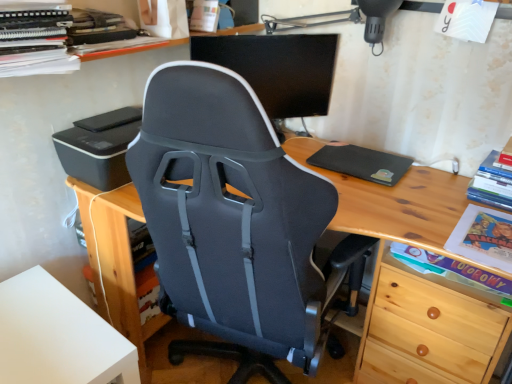
Describe the element at coordinates (492, 184) in the screenshot. I see `hardcover book at right, marked as the first book in a right-to-left arrangement` at that location.

What do you see at coordinates (403, 214) in the screenshot? The image size is (512, 384). I see `wooden desk at center` at bounding box center [403, 214].

Describe the element at coordinates (99, 147) in the screenshot. I see `black plastic printer at left` at that location.

The image size is (512, 384). What do you see at coordinates (35, 38) in the screenshot? I see `orange spiral-bound book at upper left, positioned as the 3th book in right-to-left order` at bounding box center [35, 38].

Locate an element on the screen. hardcover book at right, which appears as the third book when viewed from the left is located at coordinates (492, 184).

Is black matte/black rubberized mousepad at right far from black plastic printer at left?

No, black matte/black rubberized mousepad at right is not far from black plastic printer at left.

Does black matte/black rubberized mousepad at right appear on the left side of black plastic printer at left?

In fact, black matte/black rubberized mousepad at right is to the right of black plastic printer at left.

Does black matte/black rubberized mousepad at right lie in front of black plastic printer at left?

No, the depth of black matte/black rubberized mousepad at right is greater than that of black plastic printer at left.

Between black matte/black rubberized mousepad at right and black plastic printer at left, which one has larger width?

black plastic printer at left.

Locate an element on the screen. printer behind the hardcover book at right, the second book from the bottom is located at coordinates (99, 147).

Is black plastic printer at left wider or thinner than hardcover book at right, which appears as the third book when viewed from the left?

black plastic printer at left is wider than hardcover book at right, which appears as the third book when viewed from the left.

From the picture: Is black plastic printer at left further to camera compared to hardcover book at right, which appears as the third book when viewed from the left?

That is True.

Based on the photo, considering the sizes of objects matte cardboard book at lower right, placed as the 1th book when sorted from bottom to top, and wooden desk at center in the image provided, who is taller, matte cardboard book at lower right, placed as the 1th book when sorted from bottom to top, or wooden desk at center?

With more height is wooden desk at center.

Does matte cardboard book at lower right, the second book in the right-to-left sequence, turn towards wooden desk at center?

Yes, matte cardboard book at lower right, the second book in the right-to-left sequence, is oriented towards wooden desk at center.

Consider the image. Which object is closer to the camera taking this photo, matte cardboard book at lower right, placed as the 1th book when sorted from bottom to top, or wooden desk at center?

wooden desk at center.

Which of these two, matte cardboard book at lower right, which ranks as the 2th book in left-to-right order, or wooden desk at center, is bigger?

wooden desk at center is bigger.

From the image's perspective, which is above, black plastic printer at left or orange spiral-bound book at upper left, which is the 1th book from left to right?

orange spiral-bound book at upper left, which is the 1th book from left to right, appears higher in the image.

Considering the relative sizes of black plastic printer at left and orange spiral-bound book at upper left, the third book when ordered from bottom to top, in the image provided, is black plastic printer at left shorter than orange spiral-bound book at upper left, the third book when ordered from bottom to top,?

Yes.

Find the location of a particular element. Image resolution: width=512 pixels, height=384 pixels. book that is the 3rd one when counting forward from the black plastic printer at left is located at coordinates (35, 38).

Is black plastic printer at left inside or outside of orange spiral-bound book at upper left, which is the 1th book from left to right?

black plastic printer at left is not enclosed by orange spiral-bound book at upper left, which is the 1th book from left to right.

Between point (4, 15) and point (155, 190), which one is positioned behind?

The point (4, 15) is farther from the camera.

Which object is wider, orange spiral-bound book at upper left, positioned as the 3th book in right-to-left order, or matte black chair at center?

matte black chair at center is wider.

Based on the photo, from the image's perspective, is orange spiral-bound book at upper left, positioned as the 3th book in right-to-left order, above matte black chair at center?

Yes.

Considering the relative sizes of orange spiral-bound book at upper left, positioned as the 3th book in right-to-left order, and wooden desk at center in the image provided, is orange spiral-bound book at upper left, positioned as the 3th book in right-to-left order, taller than wooden desk at center?

No.

Between orange spiral-bound book at upper left, which is the 1th book from left to right, and wooden desk at center, which one has smaller size?

orange spiral-bound book at upper left, which is the 1th book from left to right, is smaller.

Is orange spiral-bound book at upper left, the first book from the top, in front of wooden desk at center?

No, the depth of orange spiral-bound book at upper left, the first book from the top, is greater than that of wooden desk at center.

Is orange spiral-bound book at upper left, positioned as the 3th book in right-to-left order, situated inside wooden desk at center or outside?

orange spiral-bound book at upper left, positioned as the 3th book in right-to-left order, cannot be found inside wooden desk at center.

From their relative heights in the image, would you say black matte/black rubberized mousepad at right is taller or shorter than orange spiral-bound book at upper left, the first book from the top?

Clearly, black matte/black rubberized mousepad at right is shorter compared to orange spiral-bound book at upper left, the first book from the top.

Is black matte/black rubberized mousepad at right in front of or behind orange spiral-bound book at upper left, the first book from the top, in the image?

Clearly, black matte/black rubberized mousepad at right is behind orange spiral-bound book at upper left, the first book from the top.

Looking at their sizes, would you say black matte/black rubberized mousepad at right is wider or thinner than orange spiral-bound book at upper left, which is the 1th book from left to right?

black matte/black rubberized mousepad at right is wider than orange spiral-bound book at upper left, which is the 1th book from left to right.

From the image's perspective, who appears lower, black matte/black rubberized mousepad at right or orange spiral-bound book at upper left, positioned as the 3th book in right-to-left order?

black matte/black rubberized mousepad at right.

Find the location of a particular element. This screenshot has width=512, height=384. printer located on the left of black matte/black rubberized mousepad at right is located at coordinates (99, 147).

At what (x,y) coordinates should I click in order to perform the action: click on printer behind the hardcover book at right, the second book from the bottom. Please return your answer as a coordinate pair (x, y). Image resolution: width=512 pixels, height=384 pixels. Looking at the image, I should click on (99, 147).

Estimate the real-world distances between objects in this image. Which object is further from black matte monitor at center, matte cardboard book at lower right, which is the 3th book from top to bottom, or matte black chair at center?

matte cardboard book at lower right, which is the 3th book from top to bottom.

Which object lies nearer to the anchor point hardcover book at right, which appears as the third book when viewed from the left, wooden desk at center or matte black chair at center?

wooden desk at center lies closer to hardcover book at right, which appears as the third book when viewed from the left, than the other object.

Looking at the image, which one is located closer to hardcover book at right, which appears as the third book when viewed from the left, black matte/black rubberized mousepad at right or white matte table at lower left?

Based on the image, black matte/black rubberized mousepad at right appears to be nearer to hardcover book at right, which appears as the third book when viewed from the left.

From the picture: From the image, which object appears to be farther from white matte table at lower left, matte black chair at center or orange spiral-bound book at upper left, which is the 1th book from left to right?

The object further to white matte table at lower left is orange spiral-bound book at upper left, which is the 1th book from left to right.

Which object lies nearer to the anchor point matte cardboard book at lower right, which is the 3th book from top to bottom, white matte table at lower left or black matte monitor at center?

black matte monitor at center is closer to matte cardboard book at lower right, which is the 3th book from top to bottom.

Estimate the real-world distances between objects in this image. Which object is further from wooden desk at center, orange spiral-bound book at upper left, positioned as the 3th book in right-to-left order, or matte cardboard book at lower right, which ranks as the 2th book in left-to-right order?

orange spiral-bound book at upper left, positioned as the 3th book in right-to-left order.

In the scene shown: Estimate the real-world distances between objects in this image. Which object is further from white matte table at lower left, hardcover book at right, positioned as the second book in top-to-bottom order, or black matte/black rubberized mousepad at right?

The object further to white matte table at lower left is hardcover book at right, positioned as the second book in top-to-bottom order.

Which object lies nearer to the anchor point matte cardboard book at lower right, placed as the 1th book when sorted from bottom to top, matte black chair at center or black matte/black rubberized mousepad at right?

black matte/black rubberized mousepad at right is positioned closer to the anchor matte cardboard book at lower right, placed as the 1th book when sorted from bottom to top.

What are the coordinates of `computer monitor between white matte table at lower left and black matte/black rubberized mousepad at right from left to right` in the screenshot? It's located at (208, 49).

This screenshot has width=512, height=384. In order to click on chair between orange spiral-bound book at upper left, the third book when ordered from bottom to top, and wooden desk at center in this screenshot , I will do `click(232, 222)`.

You are a GUI agent. You are given a task and a screenshot of the screen. Output one action in this format:
    pyautogui.click(x=<x>, y=<y>)
    Task: Click on the computer monitor located between orange spiral-bound book at upper left, positioned as the 3th book in right-to-left order, and wooden desk at center in the left-right direction
    
    Given the screenshot: What is the action you would take?
    pyautogui.click(x=208, y=49)

What are the coordinates of `paperback book between matte black chair at center and hardcover book at right, which appears as the third book when viewed from the left, in the horizontal direction` in the screenshot? It's located at (362, 163).